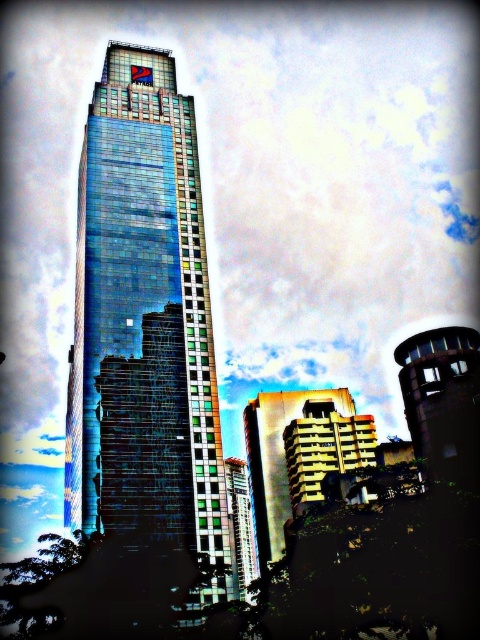
Question: Does metallic gold building at center appear over green glass building at lower center?

Choices:
 (A) no
 (B) yes

Answer: (B)

Question: Considering the real-world distances, which object is farthest from the rustic metal tower at lower right?

Choices:
 (A) metallic gold building at center
 (B) shiny glass skyscraper at center

Answer: (A)

Question: Is rustic metal tower at lower right positioned before green glass building at lower center?

Choices:
 (A) no
 (B) yes

Answer: (B)

Question: Which point is closer to the camera taking this photo?

Choices:
 (A) (282, 508)
 (B) (474, 336)

Answer: (B)

Question: Which object is closer to the camera taking this photo?

Choices:
 (A) shiny glass skyscraper at center
 (B) green glass building at lower center
 (C) rustic metal tower at lower right
 (D) metallic gold building at center

Answer: (C)

Question: Is shiny glass skyscraper at center in front of green glass building at lower center?

Choices:
 (A) yes
 (B) no

Answer: (A)